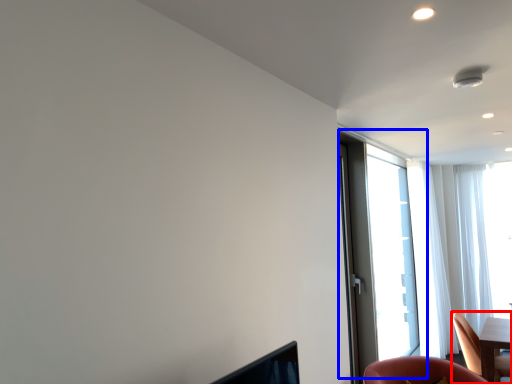
Question: Which object appears farthest to the camera in this image, chair (highlighted by a red box) or window (highlighted by a blue box)?

Choices:
 (A) chair
 (B) window

Answer: (B)